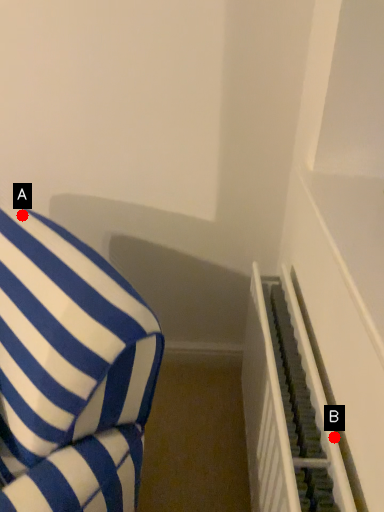
Question: Two points are circled on the image, labeled by A and B beside each circle. Which of the following is the farthest from the observer?

Choices:
 (A) A is further
 (B) B is further

Answer: (A)